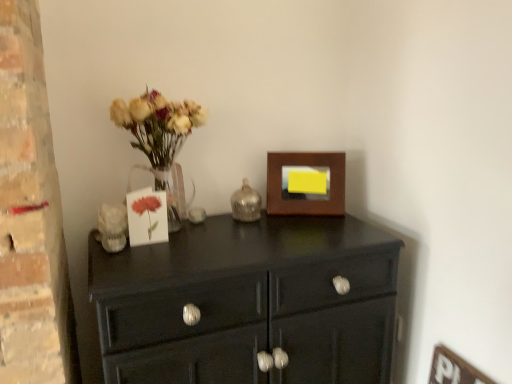
The height and width of the screenshot is (384, 512). Describe the element at coordinates (306, 183) in the screenshot. I see `wooden picture frame at upper right` at that location.

The height and width of the screenshot is (384, 512). I want to click on shiny metallic candle holder at center, so click(246, 203).

Measure the distance between matte glass vase with dried flowers at left and camera.

The depth of matte glass vase with dried flowers at left is 1.14 meters.

At what (x,y) coordinates should I click in order to perform the action: click on wooden picture frame at upper right. Please return your answer as a coordinate pair (x, y). Looking at the image, I should click on (306, 183).

From their relative heights in the image, would you say glossy black cabinet at center is taller or shorter than white matte card at center?

glossy black cabinet at center is taller than white matte card at center.

Which object is positioned more to the right, glossy black cabinet at center or white matte card at center?

glossy black cabinet at center is more to the right.

Is white matte card at center at the back of glossy black cabinet at center?

That's not correct — glossy black cabinet at center is not looking away from white matte card at center.

From the image's perspective, who appears lower, glossy black cabinet at center or white matte card at center?

glossy black cabinet at center, from the image's perspective.

Identify the location of floral arrangement that appears above the wooden picture frame at upper right (from the image's perspective). (161, 140).

Between wooden picture frame at upper right and matte glass vase with dried flowers at left, which one appears on the right side from the viewer's perspective?

wooden picture frame at upper right is more to the right.

From a real-world perspective, between wooden picture frame at upper right and matte glass vase with dried flowers at left, who is vertically lower?

wooden picture frame at upper right.

How much distance is there between glossy black cabinet at center and wooden picture frame at upper right?

A distance of 14.91 inches exists between glossy black cabinet at center and wooden picture frame at upper right.

From a real-world perspective, which is physically above, glossy black cabinet at center or wooden picture frame at upper right?

wooden picture frame at upper right, from a real-world perspective.

Is glossy black cabinet at center inside the boundaries of wooden picture frame at upper right, or outside?

glossy black cabinet at center lies outside wooden picture frame at upper right.

Is glossy black cabinet at center next to wooden picture frame at upper right and touching it?

glossy black cabinet at center and wooden picture frame at upper right are not in contact.

Is white matte card at center further to the viewer compared to matte glass vase with dried flowers at left?

Yes.

Is matte glass vase with dried flowers at left completely or partially inside white matte card at center?

No, matte glass vase with dried flowers at left is located outside of white matte card at center.

Between white matte card at center and matte glass vase with dried flowers at left, which one has larger size?

With larger size is matte glass vase with dried flowers at left.

The image size is (512, 384). I want to click on flower on the left of the glossy black cabinet at center, so click(x=147, y=209).

Looking at their sizes, would you say white matte card at center is wider or thinner than glossy black cabinet at center?

Considering their sizes, white matte card at center looks slimmer than glossy black cabinet at center.

Based on the photo, can you confirm if white matte card at center is smaller than glossy black cabinet at center?

Yes.

In the scene shown: From the image's perspective, who appears lower, white matte card at center or glossy black cabinet at center?

glossy black cabinet at center, from the image's perspective.

From a real-world perspective, is shiny metallic candle holder at center physically below glossy black cabinet at center?

Incorrect, from a real-world perspective, shiny metallic candle holder at center is higher than glossy black cabinet at center.

Considering the relative sizes of shiny metallic candle holder at center and glossy black cabinet at center in the image provided, is shiny metallic candle holder at center shorter than glossy black cabinet at center?

Yes, shiny metallic candle holder at center is shorter than glossy black cabinet at center.

Can you confirm if shiny metallic candle holder at center is positioned to the left of glossy black cabinet at center?

Indeed, shiny metallic candle holder at center is positioned on the left side of glossy black cabinet at center.

Is white matte card at center touching wooden picture frame at upper right?

No, white matte card at center is not next to wooden picture frame at upper right.

Is white matte card at center positioned with its back to wooden picture frame at upper right?

No, white matte card at center is not facing the opposite direction of wooden picture frame at upper right.

Visually, is white matte card at center positioned to the left or to the right of wooden picture frame at upper right?

From the image, it's evident that white matte card at center is to the left of wooden picture frame at upper right.

Locate an element on the screen. The image size is (512, 384). flower that appears above the glossy black cabinet at center (from the image's perspective) is located at coordinates (147, 209).

This screenshot has width=512, height=384. I want to click on floral arrangement to the left of wooden picture frame at upper right, so click(161, 140).

Based on their spatial positions, is matte glass vase with dried flowers at left or shiny metallic candle holder at center closer to white matte card at center?

Among the two, matte glass vase with dried flowers at left is located nearer to white matte card at center.

From the image, which object appears to be farther from shiny metallic candle holder at center, wooden picture frame at upper right or glossy black cabinet at center?

Among the two, glossy black cabinet at center is located further to shiny metallic candle holder at center.

From the image, which object appears to be nearer to matte glass vase with dried flowers at left, shiny metallic candle holder at center or wooden picture frame at upper right?

shiny metallic candle holder at center.

When comparing their distances from shiny metallic candle holder at center, does matte glass vase with dried flowers at left or white matte card at center seem further?

Based on the image, white matte card at center appears to be further to shiny metallic candle holder at center.

Based on the photo, which object lies nearer to the anchor point white matte card at center, wooden picture frame at upper right or matte glass vase with dried flowers at left?

matte glass vase with dried flowers at left is closer to white matte card at center.

From the picture: Considering their positions, is wooden picture frame at upper right positioned closer to shiny metallic candle holder at center than matte glass vase with dried flowers at left?

The object closer to shiny metallic candle holder at center is wooden picture frame at upper right.

From the image, which object appears to be farther from glossy black cabinet at center, white matte card at center or wooden picture frame at upper right?

white matte card at center lies further to glossy black cabinet at center than the other object.

Estimate the real-world distances between objects in this image. Which object is closer to white matte card at center, glossy black cabinet at center or matte glass vase with dried flowers at left?

The object closer to white matte card at center is matte glass vase with dried flowers at left.

What are the coordinates of `candle holder situated between white matte card at center and wooden picture frame at upper right from left to right` in the screenshot? It's located at (246, 203).

You are a GUI agent. You are given a task and a screenshot of the screen. Output one action in this format:
    pyautogui.click(x=<x>, y=<y>)
    Task: Click on the floral arrangement between white matte card at center and wooden picture frame at upper right in the horizontal direction
    This screenshot has width=512, height=384.
    Given the screenshot: What is the action you would take?
    pyautogui.click(x=161, y=140)

I want to click on candle holder between matte glass vase with dried flowers at left and glossy black cabinet at center from top to bottom, so click(246, 203).

Find the location of a particular element. candle holder between matte glass vase with dried flowers at left and wooden picture frame at upper right in the horizontal direction is located at coordinates (246, 203).